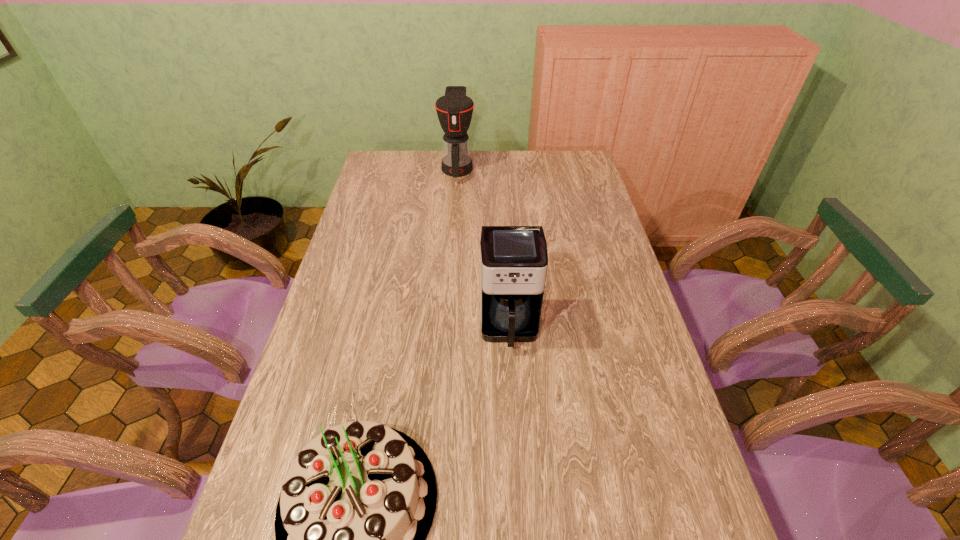
The image size is (960, 540). What are the coordinates of `vacant space at the far left corner of the desktop` in the screenshot? It's located at (371, 169).

Locate which object ranks second in proximity to the left coffee maker. Please provide its 2D coordinates. Your answer should be formatted as a tuple, i.e. [(x, y)], where the tuple contains the x and y coordinates of a point satisfying the conditions above.

[(357, 503)]

Image resolution: width=960 pixels, height=540 pixels. In order to click on the second closest object to the rightmost object in this screenshot , I will do `click(454, 110)`.